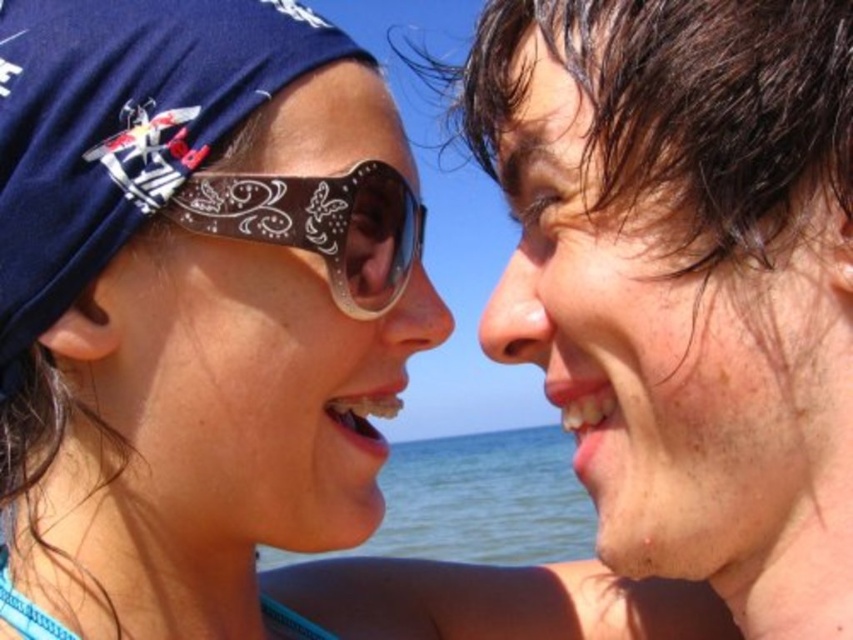
Question: Can you confirm if matte black sunglasses at left is positioned below brown leather goggles at center?

Choices:
 (A) yes
 (B) no

Answer: (A)

Question: Among these objects, which one is farthest from the camera?

Choices:
 (A) matte black sunglasses at left
 (B) dry skin face at right
 (C) brown leather goggles at center
 (D) blue water at center

Answer: (D)

Question: Is blue water at center to the left of brown leather goggles at center from the viewer's perspective?

Choices:
 (A) yes
 (B) no

Answer: (B)

Question: In this image, where is matte black sunglasses at left located relative to blue water at center?

Choices:
 (A) right
 (B) left

Answer: (B)

Question: Which object is closer to the camera taking this photo?

Choices:
 (A) blue water at center
 (B) matte black sunglasses at left

Answer: (B)

Question: Which is farther from the dry skin face at right?

Choices:
 (A) blue water at center
 (B) matte black sunglasses at left

Answer: (A)